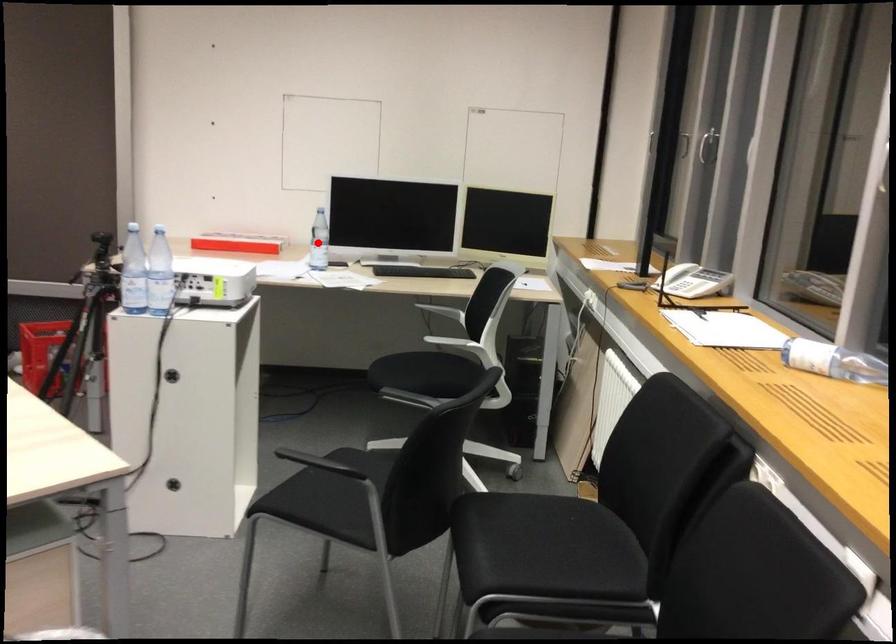
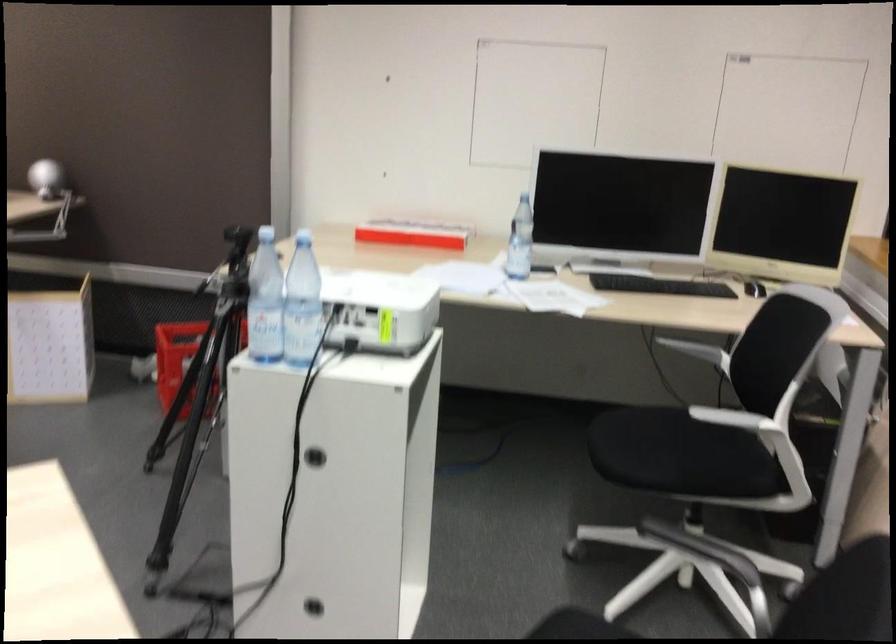
In the second image, find the point that corresponds to the highlighted location in the first image.

(520, 241)